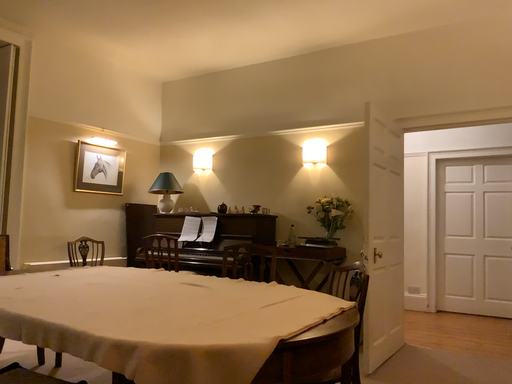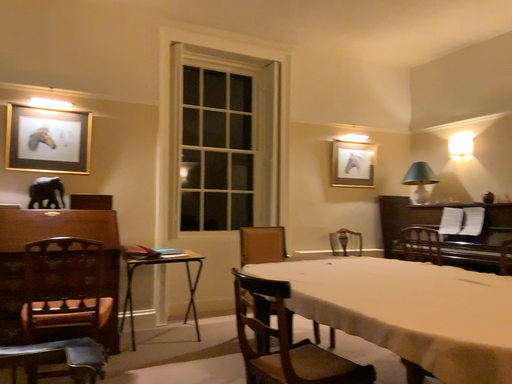
Question: Which way did the camera rotate in the video?

Choices:
 (A) rotated right
 (B) rotated left

Answer: (B)